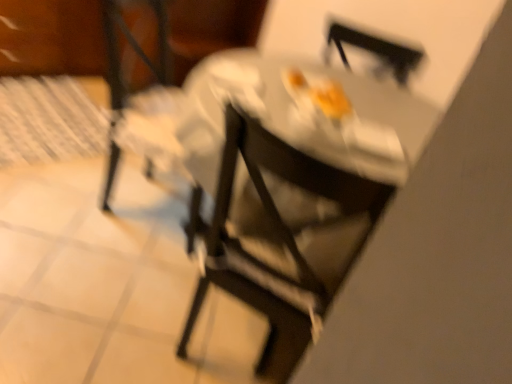
Question: Is matte black chair at center, which is the first chair in left-to-right order, in front of or behind metallic silver chair at center, the 1th chair viewed from the right, in the image?

Choices:
 (A) front
 (B) behind

Answer: (B)

Question: Considering the positions of point (119, 102) and point (372, 210), is point (119, 102) closer or farther from the camera than point (372, 210)?

Choices:
 (A) farther
 (B) closer

Answer: (A)

Question: Estimate the real-world distances between objects in this image. Which object is closer to the matte black chair at center, which is the first chair in left-to-right order?

Choices:
 (A) metallic silver chair at center, the 1th chair viewed from the right
 (B) wooden table at upper left

Answer: (B)

Question: Which object is the closest to the matte black chair at center, which is the first chair in left-to-right order?

Choices:
 (A) wooden table at upper left
 (B) metallic silver chair at center, the 2th chair viewed from the left

Answer: (A)